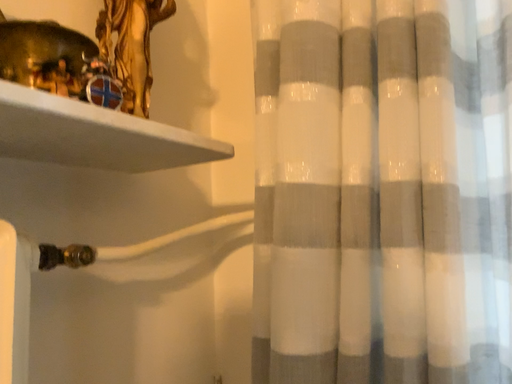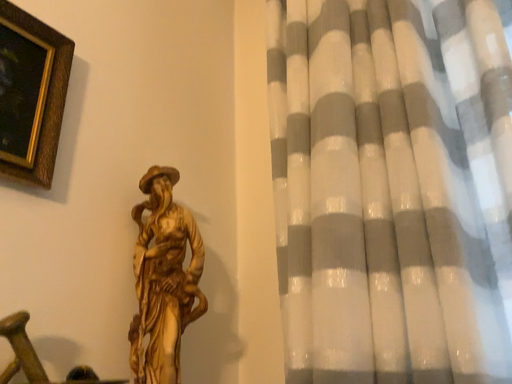
Question: Which way did the camera rotate in the video?

Choices:
 (A) rotated upward
 (B) rotated downward

Answer: (A)